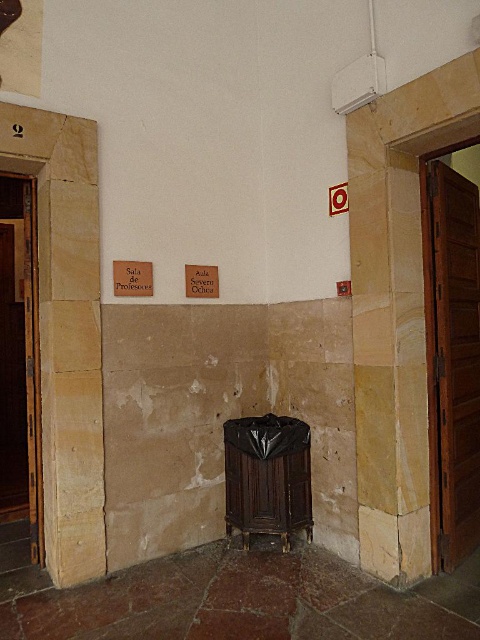
Is brown wooden door at right taller than brown wooden door at left?

No, brown wooden door at right is not taller than brown wooden door at left.

Find the location of a particular element. The image size is (480, 640). brown wooden door at right is located at coordinates 452,356.